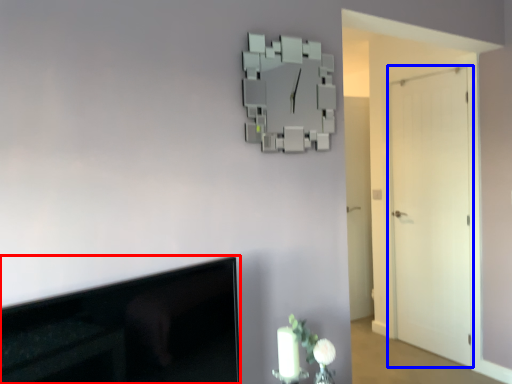
Question: Which point is closer to the camera, television (highlighted by a red box) or door (highlighted by a blue box)?

Choices:
 (A) television
 (B) door

Answer: (A)